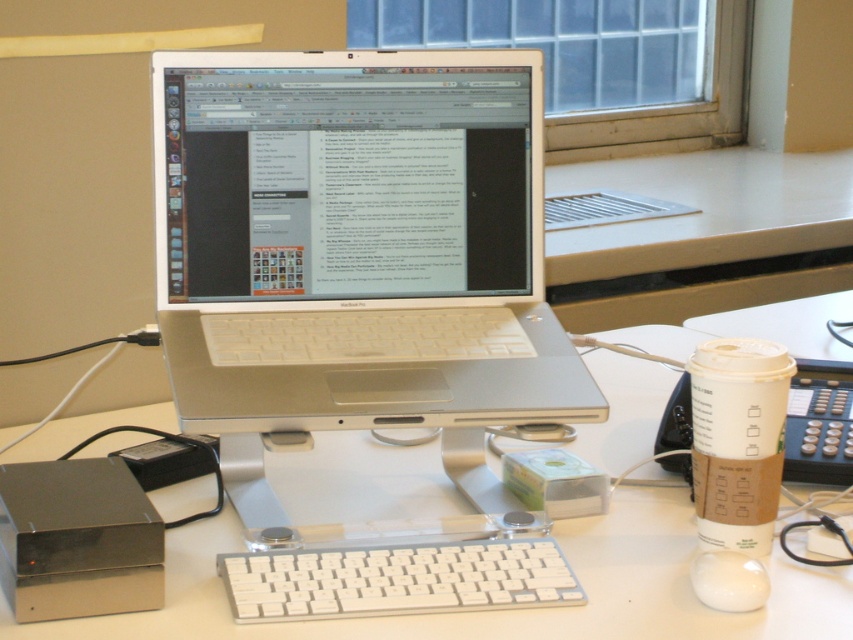
You are a person sitting at the desk and want to reach both the white plastic laptop at center and the white glossy mouse at lower right. Which object will your hand need to move closer to you to reach first?

The white plastic laptop at center is closer to you than the white glossy mouse at lower right, so you will need to move your hand closer to your body to reach the white plastic laptop at center first.

You are a person with a 24 inch long arm. You want to reach from the white plastic laptop at center to the white glossy mouse at lower right. Can you reach it without moving your body?

The distance between the white plastic laptop at center and the white glossy mouse at lower right is 26.75 inches. Since your arm is only 24 inches long, you cannot reach the mouse without moving your body.

You are setting up a new desk and want to place the white plastic laptop at center and the white plastic keyboard at center side by side. Based on their sizes, which one should be placed first to ensure they fit properly?

The white plastic laptop at center is wider than the white plastic keyboard at center. Therefore, you should place the white plastic laptop at center first to accommodate its larger width before positioning the keyboard next to it.